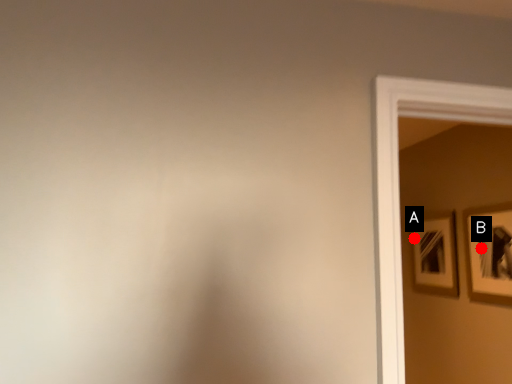
Question: Two points are circled on the image, labeled by A and B beside each circle. Which point appears closest to the camera in this image?

Choices:
 (A) A is closer
 (B) B is closer

Answer: (B)